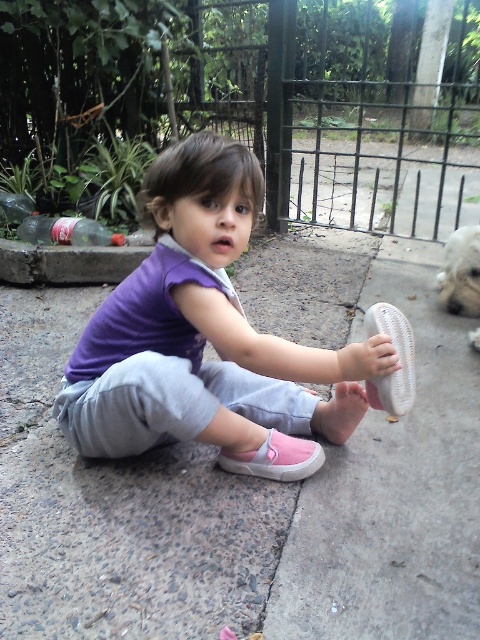
Does gray concrete pavement at center appear on the left side of white fluffy dog at right?

Indeed, gray concrete pavement at center is positioned on the left side of white fluffy dog at right.

Which is in front, point (28, 400) or point (440, 280)?

Point (28, 400)

Where is `gray concrete pavement at center`? Image resolution: width=480 pixels, height=640 pixels. gray concrete pavement at center is located at coordinates (249, 483).

Does pink fabric shoe at center lie behind white fluffy dog at right?

That is False.

Is pink fabric shoe at center positioned before white fluffy dog at right?

Yes, it is in front of white fluffy dog at right.

Locate an element on the screen. The image size is (480, 640). pink fabric shoe at center is located at coordinates (216, 339).

Does gray concrete pavement at center lie in front of pink fabric shoe at center?

Yes, it is in front of pink fabric shoe at center.

Does gray concrete pavement at center have a greater height compared to pink fabric shoe at center?

Correct, gray concrete pavement at center is much taller as pink fabric shoe at center.

Is point (113, 621) positioned before point (112, 337)?

That is True.

Locate an element on the screen. gray concrete pavement at center is located at coordinates (249, 483).